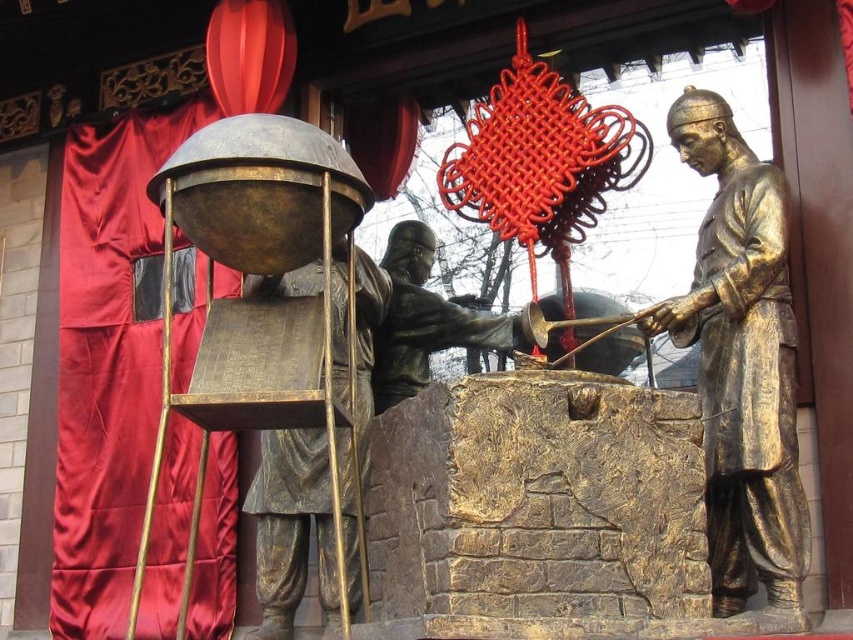
You are standing in front of a bronze sculpture with two figures. The first is the bronze statue of person at center and the second is the bronze statue at center. Which one is closer to you?

The bronze statue of person at center is closer to the viewer than the bronze statue at center.

From the picture: You are a photographer trying to capture the sculpture from the best angle. You notice two points marked on the sculpture. Which point, point [773,356] or point [355,257], is closer to your camera lens?

Point [773,356] is closer to the camera lens than point [355,257].

Please provide the exact 2D coordinates of the bronze statue of person at center in the image as per the provided description.

The bronze statue of person at center is located at the coordinates point (291, 525).